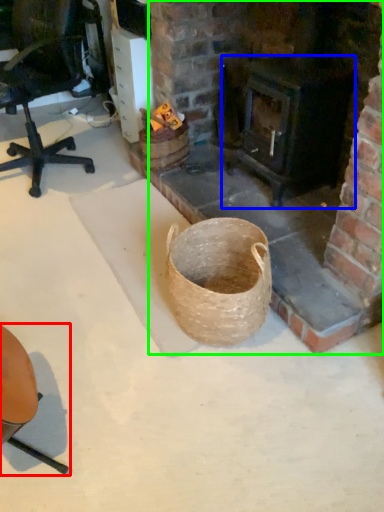
Question: Estimate the real-world distances between objects in this image. Which object is farther from chair (highlighted by a red box), stove (highlighted by a blue box) or fireplace (highlighted by a green box)?

Choices:
 (A) stove
 (B) fireplace

Answer: (A)